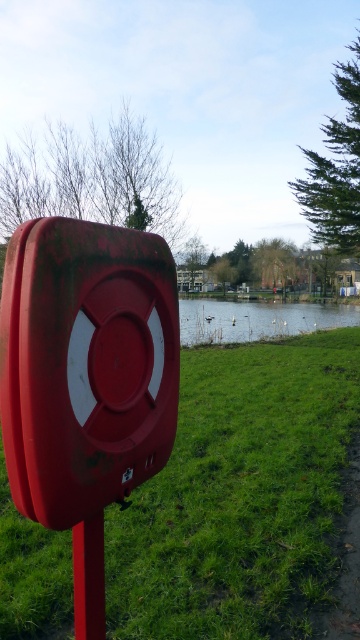
You are standing at the edge of the water and want to walk to the smooth glossy red pole at lower left without stepping on the green grassy at center. Is this possible?

The green grassy at center has a greater height compared to the smooth glossy red pole at lower left. Therefore, the smooth glossy red pole at lower left is lower in height, so you can walk around or step over the green grassy at center to reach the pole without stepping on it.

Based on the photo, you are standing in front of the red lifebuoy mounted on a pole on the left side. You want to walk towards the green grassy water at center. Which direction should you walk to avoid the green grassy at center?

The green grassy at center is closer to you than the green grassy water at center. To avoid the green grassy at center, you should walk around it towards the green grassy water at center.